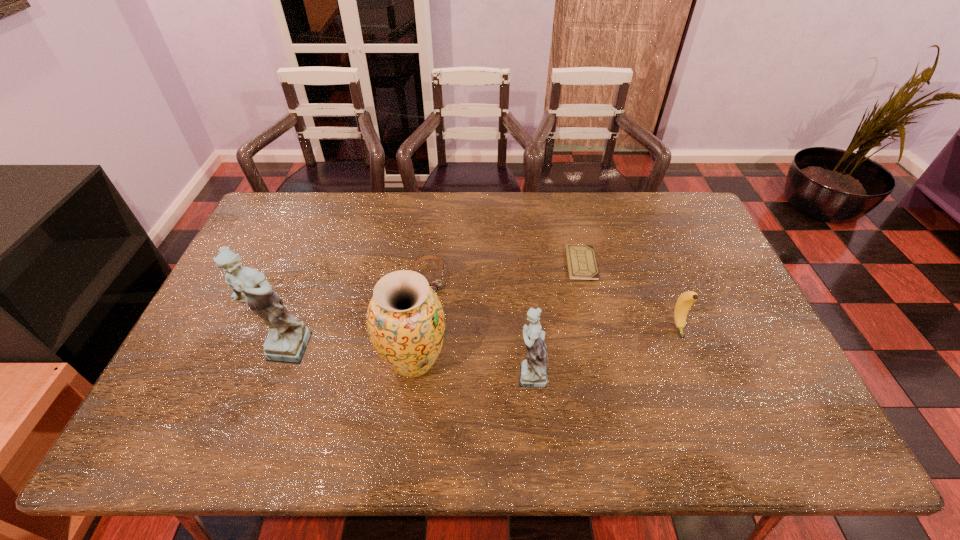
Please show where to add a figurine on the right while keeping spacing even. Please provide its 2D coordinates. Your answer should be formatted as a tuple, i.e. [(x, y)], where the tuple contains the x and y coordinates of a point satisfying the conditions above.

[(797, 396)]